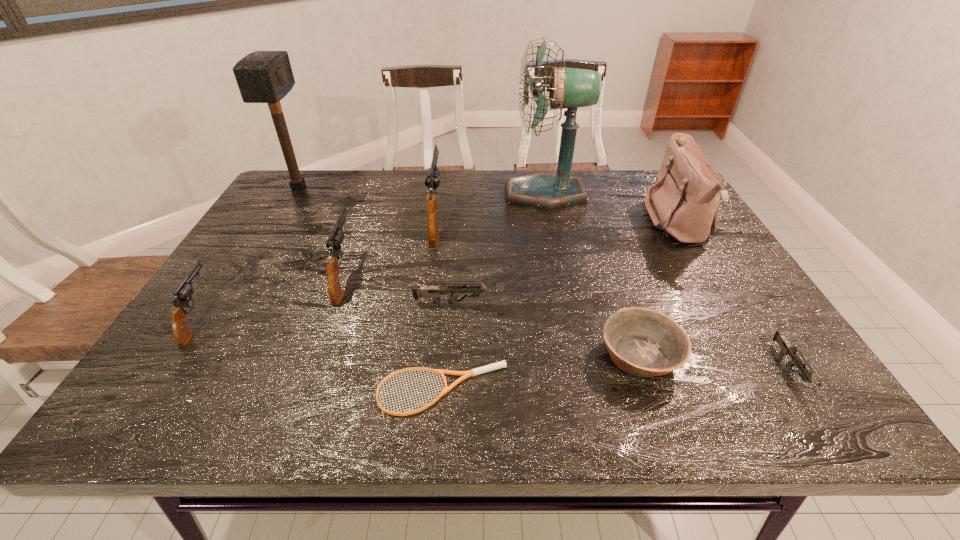
Find the location of a particular element. free location located 0.270m along the barrel of the third shortest gun is located at coordinates (259, 228).

Where is `vacant space located along the barrel of the third shortest gun`? The height and width of the screenshot is (540, 960). vacant space located along the barrel of the third shortest gun is located at coordinates [270, 212].

This screenshot has width=960, height=540. What are the coordinates of `vacant space located aimed along the barrel of the second shortest gun` in the screenshot? It's located at (573, 303).

Identify the location of vacant region located 0.060m on the front of the bowl. The image size is (960, 540). (661, 418).

This screenshot has width=960, height=540. In order to click on free space located 0.130m on the right of the shortest object in this screenshot , I will do `click(577, 390)`.

Where is `fan positioned at the far edge`? fan positioned at the far edge is located at coordinates (570, 88).

Locate an element on the screen. mallet located at the far edge is located at coordinates (262, 76).

This screenshot has width=960, height=540. Identify the location of shoulder bag positioned at the far edge. (684, 203).

This screenshot has width=960, height=540. What are the coordinates of `gun that is positioned at the far edge` in the screenshot? It's located at (432, 180).

Find the location of a particular element. The image size is (960, 540). bowl situated at the near edge is located at coordinates (642, 342).